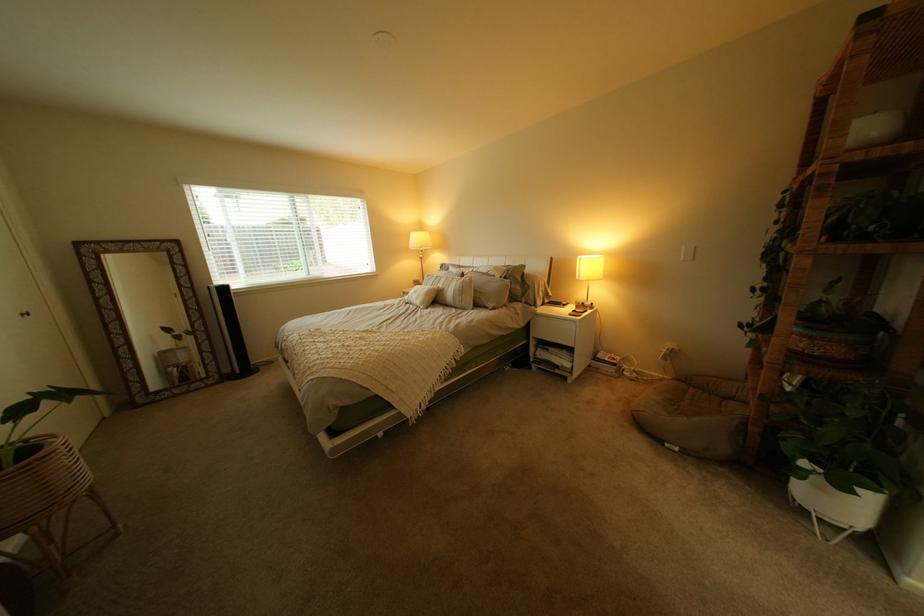
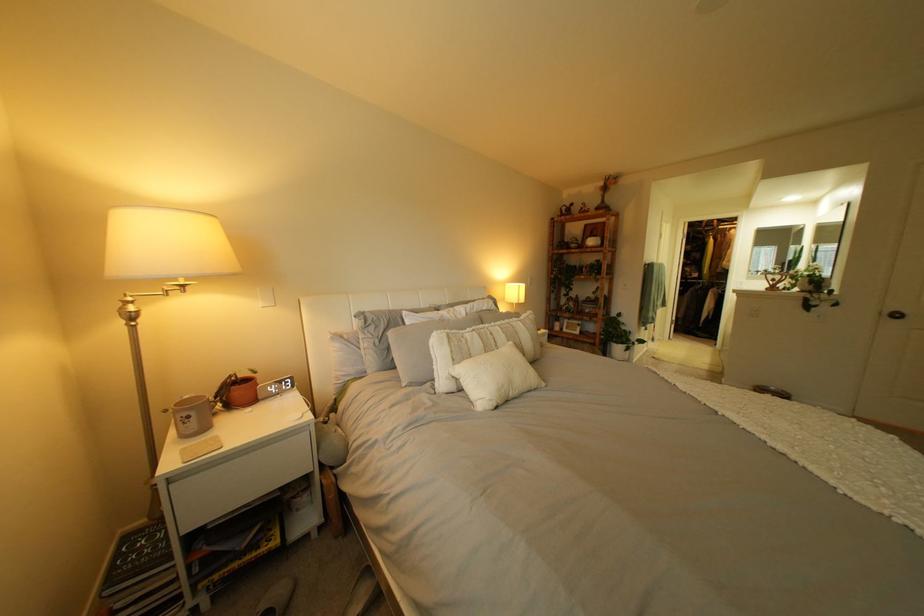
Find the pixel in the second image that matches point (442, 286) in the first image.

(485, 355)